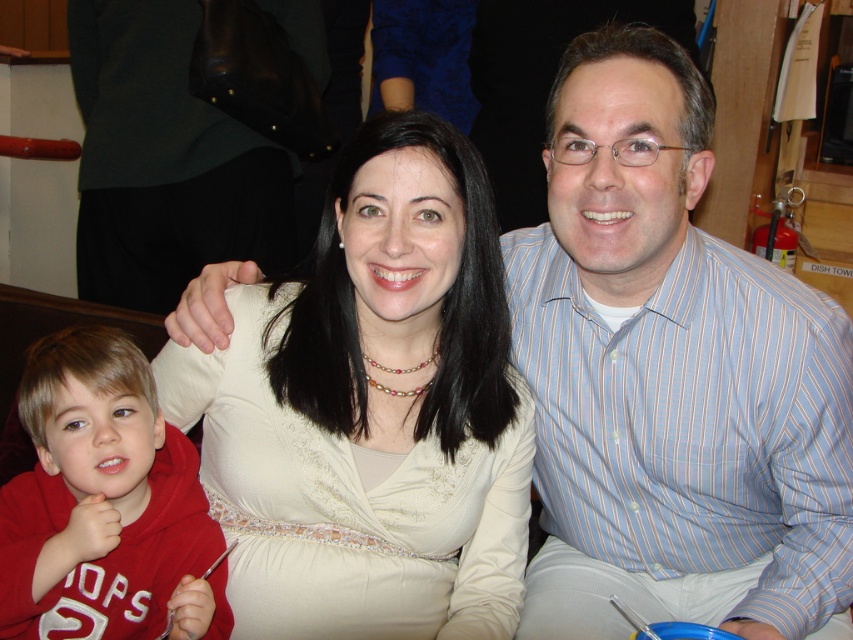
You are a photographer trying to adjust the lighting for a portrait. You notice the matte white blouse at center and the red fleece hoodie at lower left. Which object should you focus the light on to ensure it appears brighter in the photo, considering their sizes?

The matte white blouse at center has a greater height compared to the red fleece hoodie at lower left, so focusing the light on the matte white blouse at center would ensure it appears brighter due to its larger size.